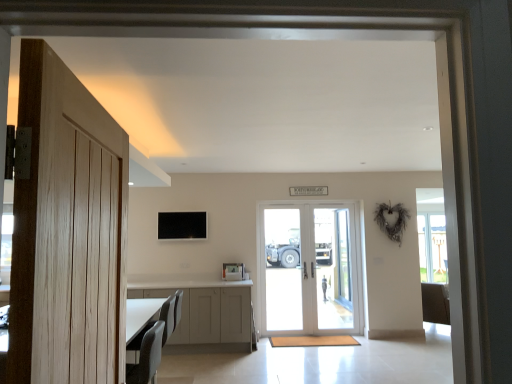
Question: Is point (173, 322) positioned closer to the camera than point (69, 380)?

Choices:
 (A) closer
 (B) farther

Answer: (B)

Question: Is matte gray chair at lower left bigger or smaller than light wood door at left, which is the 1th door in front-to-back order?

Choices:
 (A) big
 (B) small

Answer: (A)

Question: Estimate the real-world distances between objects in this image. Which object is closer to the white glossy door at center, which is the 2th door from left to right?

Choices:
 (A) clear glass door at center, which ranks as the 1th screen door in right-to-left order
 (B) matte gray chair at lower left
 (C) gray fabric armchair at lower left
 (D) light wood door at left, which is the 1th door in front-to-back order
 (E) white glass screen door at center, the 1th screen door viewed from the left

Answer: (A)

Question: Estimate the real-world distances between objects in this image. Which object is farther from the white glossy door at center, acting as the first door starting from the right?

Choices:
 (A) light wood door at left, which is counted as the 2th door, starting from the back
 (B) gray fabric armchair at lower left
 (C) clear glass door at center, which ranks as the 1th screen door in right-to-left order
 (D) white glass screen door at center, which ranks as the 2th screen door in right-to-left order
 (E) matte gray chair at lower left

Answer: (A)